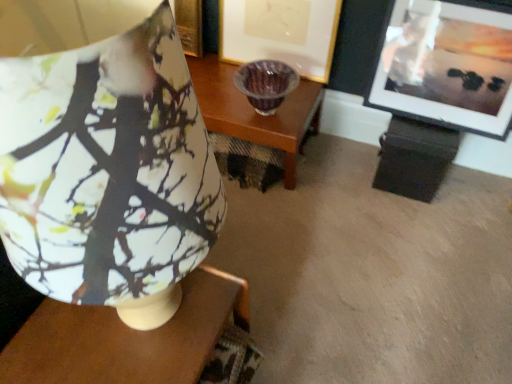
The width and height of the screenshot is (512, 384). In order to click on matte wood table at center in this screenshot , I will do `click(126, 338)`.

How much space does matte black picture frame at upper right, which is counted as the 1th picture frame, starting from the right, occupy horizontally?

The width of matte black picture frame at upper right, which is counted as the 1th picture frame, starting from the right, is 4.41 inches.

This screenshot has width=512, height=384. In order to click on matte wood table at center in this screenshot , I will do `click(126, 338)`.

From a real-world perspective, is matte wood table at center under matte black picture frame at upper right, marked as the 2th picture frame in a left-to-right arrangement?

Yes, from a real-world perspective, matte wood table at center is under matte black picture frame at upper right, marked as the 2th picture frame in a left-to-right arrangement.

Is matte wood table at center spatially inside matte black picture frame at upper right, which is counted as the 1th picture frame, starting from the right, or outside of it?

matte wood table at center is not inside matte black picture frame at upper right, which is counted as the 1th picture frame, starting from the right, it's outside.

Between matte wood table at center and matte black picture frame at upper right, marked as the 2th picture frame in a left-to-right arrangement, which one has smaller width?

matte black picture frame at upper right, marked as the 2th picture frame in a left-to-right arrangement.

Considering the points (80, 308) and (487, 72), which point is behind, point (80, 308) or point (487, 72)?

The point (487, 72) is farther from the camera.

In terms of width, does matte black picture frame at upper right, marked as the 2th picture frame in a left-to-right arrangement, look wider or thinner when compared to matte wood table at center?

matte black picture frame at upper right, marked as the 2th picture frame in a left-to-right arrangement, is thinner than matte wood table at center.

Does matte black picture frame at upper right, marked as the 2th picture frame in a left-to-right arrangement, have a larger size compared to matte wood table at center?

No, matte black picture frame at upper right, marked as the 2th picture frame in a left-to-right arrangement, is not bigger than matte wood table at center.

From a real-world perspective, is matte black picture frame at upper right, which is counted as the 1th picture frame, starting from the right, positioned above or below matte wood table at center?

In terms of real-world spatial position, matte black picture frame at upper right, which is counted as the 1th picture frame, starting from the right, is above matte wood table at center.

Is matte black picture frame at upper right, marked as the 2th picture frame in a left-to-right arrangement, located outside matte wood table at center?

Yes.

From the picture: Considering the positions of objects matte black picture frame at upper right, marked as the 2th picture frame in a left-to-right arrangement, and matte gold picture frame at center, which appears as the 1th picture frame when viewed from the left, in the image provided, who is behind, matte black picture frame at upper right, marked as the 2th picture frame in a left-to-right arrangement, or matte gold picture frame at center, which appears as the 1th picture frame when viewed from the left,?

matte gold picture frame at center, which appears as the 1th picture frame when viewed from the left, is behind.

Is matte black picture frame at upper right, which is counted as the 1th picture frame, starting from the right, to the left or to the right of matte gold picture frame at center, which is counted as the 2th picture frame, starting from the right, in the image?

Based on their positions, matte black picture frame at upper right, which is counted as the 1th picture frame, starting from the right, is located to the right of matte gold picture frame at center, which is counted as the 2th picture frame, starting from the right.

Consider the image. In terms of width, does matte black picture frame at upper right, which is counted as the 1th picture frame, starting from the right, look wider or thinner when compared to matte gold picture frame at center, which is counted as the 2th picture frame, starting from the right?

matte black picture frame at upper right, which is counted as the 1th picture frame, starting from the right, is wider than matte gold picture frame at center, which is counted as the 2th picture frame, starting from the right.

Which of these two, matte ceramic lampshade at upper left or matte gold picture frame at center, which appears as the 1th picture frame when viewed from the left, stands taller?

matte ceramic lampshade at upper left.

From a real-world perspective, does matte ceramic lampshade at upper left stand above matte gold picture frame at center, which appears as the 1th picture frame when viewed from the left?

Indeed, from a real-world perspective, matte ceramic lampshade at upper left stands above matte gold picture frame at center, which appears as the 1th picture frame when viewed from the left.

Is there a large distance between matte ceramic lampshade at upper left and matte gold picture frame at center, which is counted as the 2th picture frame, starting from the right?

Yes, matte ceramic lampshade at upper left is far from matte gold picture frame at center, which is counted as the 2th picture frame, starting from the right.

Considering the relative positions of matte ceramic lampshade at upper left and matte gold picture frame at center, which is counted as the 2th picture frame, starting from the right, in the image provided, is matte ceramic lampshade at upper left to the right of matte gold picture frame at center, which is counted as the 2th picture frame, starting from the right, from the viewer's perspective?

No, matte ceramic lampshade at upper left is not to the right of matte gold picture frame at center, which is counted as the 2th picture frame, starting from the right.

Is matte ceramic lampshade at upper left outside of matte wood table at center?

matte ceramic lampshade at upper left lies outside matte wood table at center's area.

Locate an element on the screen. The height and width of the screenshot is (384, 512). lamp above the matte wood table at center (from the image's perspective) is located at coordinates (103, 156).

From the image's perspective, is matte ceramic lampshade at upper left under matte wood table at center?

No, from the image's perspective, matte ceramic lampshade at upper left is not beneath matte wood table at center.

Measure the distance from matte ceramic lampshade at upper left to matte wood table at center.

A distance of 12.16 inches exists between matte ceramic lampshade at upper left and matte wood table at center.

From a real-world perspective, is matte ceramic lampshade at upper left above or below matte black picture frame at upper right, which is counted as the 1th picture frame, starting from the right?

matte ceramic lampshade at upper left is situated higher than matte black picture frame at upper right, which is counted as the 1th picture frame, starting from the right, in the real world.

In the scene shown: Based on their sizes in the image, would you say matte ceramic lampshade at upper left is bigger or smaller than matte black picture frame at upper right, which is counted as the 1th picture frame, starting from the right?

Considering their sizes, matte ceramic lampshade at upper left takes up more space than matte black picture frame at upper right, which is counted as the 1th picture frame, starting from the right.

Is matte ceramic lampshade at upper left at the right side of matte black picture frame at upper right, which is counted as the 1th picture frame, starting from the right?

No, matte ceramic lampshade at upper left is not to the right of matte black picture frame at upper right, which is counted as the 1th picture frame, starting from the right.

Considering the sizes of matte ceramic lampshade at upper left and matte black picture frame at upper right, marked as the 2th picture frame in a left-to-right arrangement, in the image, is matte ceramic lampshade at upper left wider or thinner than matte black picture frame at upper right, marked as the 2th picture frame in a left-to-right arrangement,?

Considering their sizes, matte ceramic lampshade at upper left looks broader than matte black picture frame at upper right, marked as the 2th picture frame in a left-to-right arrangement.

Consider the image. Could you tell me if matte gold picture frame at center, which appears as the 1th picture frame when viewed from the left, is turned towards matte ceramic lampshade at upper left?

Yes, matte gold picture frame at center, which appears as the 1th picture frame when viewed from the left, is facing matte ceramic lampshade at upper left.

Consider the image. Is matte gold picture frame at center, which appears as the 1th picture frame when viewed from the left, behind matte ceramic lampshade at upper left?

Yes, the depth of matte gold picture frame at center, which appears as the 1th picture frame when viewed from the left, is greater than that of matte ceramic lampshade at upper left.

Based on the photo, is matte gold picture frame at center, which appears as the 1th picture frame when viewed from the left, smaller than matte ceramic lampshade at upper left?

Yes, matte gold picture frame at center, which appears as the 1th picture frame when viewed from the left, is smaller than matte ceramic lampshade at upper left.

Is matte ceramic lampshade at upper left surrounded by matte gold picture frame at center, which is counted as the 2th picture frame, starting from the right?

No, matte ceramic lampshade at upper left is not inside matte gold picture frame at center, which is counted as the 2th picture frame, starting from the right.

This screenshot has width=512, height=384. In order to click on table directly beneath the matte black picture frame at upper right, which is counted as the 1th picture frame, starting from the right (from a real-world perspective) in this screenshot , I will do `click(126, 338)`.

Starting from the matte wood table at center, which picture frame is the 2nd one to the right? Please provide its 2D coordinates.

[(447, 67)]

Estimate the real-world distances between objects in this image. Which object is further from matte wood table at center, matte gold picture frame at center, which is counted as the 2th picture frame, starting from the right, or matte ceramic lampshade at upper left?

matte gold picture frame at center, which is counted as the 2th picture frame, starting from the right, is positioned further to the anchor matte wood table at center.

Based on their spatial positions, is matte wood table at center or matte gold picture frame at center, which is counted as the 2th picture frame, starting from the right, closer to matte black picture frame at upper right, marked as the 2th picture frame in a left-to-right arrangement?

Among the two, matte gold picture frame at center, which is counted as the 2th picture frame, starting from the right, is located nearer to matte black picture frame at upper right, marked as the 2th picture frame in a left-to-right arrangement.

Considering their positions, is matte gold picture frame at center, which appears as the 1th picture frame when viewed from the left, positioned closer to matte ceramic lampshade at upper left than matte wood table at center?

matte wood table at center is closer to matte ceramic lampshade at upper left.

Estimate the real-world distances between objects in this image. Which object is further from matte ceramic lampshade at upper left, matte wood table at center or matte black picture frame at upper right, marked as the 2th picture frame in a left-to-right arrangement?

matte black picture frame at upper right, marked as the 2th picture frame in a left-to-right arrangement, lies further to matte ceramic lampshade at upper left than the other object.

When comparing their distances from matte wood table at center, does matte ceramic lampshade at upper left or matte black picture frame at upper right, marked as the 2th picture frame in a left-to-right arrangement, seem closer?

Based on the image, matte ceramic lampshade at upper left appears to be nearer to matte wood table at center.

From the image, which object appears to be nearer to matte gold picture frame at center, which is counted as the 2th picture frame, starting from the right, matte black picture frame at upper right, marked as the 2th picture frame in a left-to-right arrangement, or matte ceramic lampshade at upper left?

The object closer to matte gold picture frame at center, which is counted as the 2th picture frame, starting from the right, is matte black picture frame at upper right, marked as the 2th picture frame in a left-to-right arrangement.

When comparing their distances from matte gold picture frame at center, which appears as the 1th picture frame when viewed from the left, does matte ceramic lampshade at upper left or matte black picture frame at upper right, which is counted as the 1th picture frame, starting from the right, seem closer?

matte black picture frame at upper right, which is counted as the 1th picture frame, starting from the right, is closer to matte gold picture frame at center, which appears as the 1th picture frame when viewed from the left.

When comparing their distances from matte wood table at center, does matte black picture frame at upper right, marked as the 2th picture frame in a left-to-right arrangement, or matte gold picture frame at center, which appears as the 1th picture frame when viewed from the left, seem closer?

Among the two, matte black picture frame at upper right, marked as the 2th picture frame in a left-to-right arrangement, is located nearer to matte wood table at center.

The image size is (512, 384). I want to click on lamp situated between matte wood table at center and matte black picture frame at upper right, marked as the 2th picture frame in a left-to-right arrangement, from left to right, so click(x=103, y=156).

You are a GUI agent. You are given a task and a screenshot of the screen. Output one action in this format:
    pyautogui.click(x=<x>, y=<y>)
    Task: Click on the table between matte ceramic lampshade at upper left and matte gold picture frame at center, which appears as the 1th picture frame when viewed from the left, from front to back
    The height and width of the screenshot is (384, 512).
    Given the screenshot: What is the action you would take?
    pyautogui.click(x=126, y=338)

At what (x,y) coordinates should I click in order to perform the action: click on picture frame between matte gold picture frame at center, which is counted as the 2th picture frame, starting from the right, and matte wood table at center from top to bottom. Please return your answer as a coordinate pair (x, y). Looking at the image, I should click on (447, 67).

Locate an element on the screen. picture frame between matte ceramic lampshade at upper left and matte gold picture frame at center, which is counted as the 2th picture frame, starting from the right, from front to back is located at coordinates (447, 67).